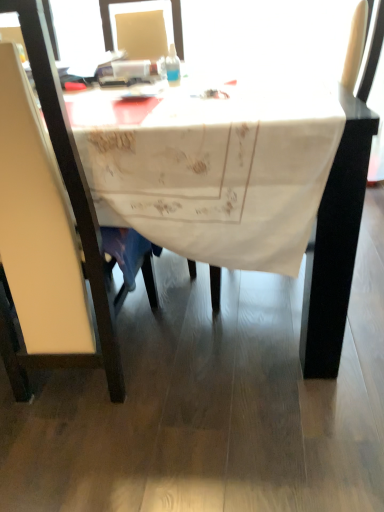
Question: Can you confirm if white leather chair at left is wider than white embroidered tablecloth at center?

Choices:
 (A) no
 (B) yes

Answer: (A)

Question: From the image's perspective, is white leather chair at left under white embroidered tablecloth at center?

Choices:
 (A) yes
 (B) no

Answer: (A)

Question: Is white leather chair at left not inside white embroidered tablecloth at center?

Choices:
 (A) yes
 (B) no

Answer: (B)

Question: Are white leather chair at left and white embroidered tablecloth at center beside each other?

Choices:
 (A) no
 (B) yes

Answer: (A)

Question: Is white leather chair at left at the right side of white embroidered tablecloth at center?

Choices:
 (A) yes
 (B) no

Answer: (B)

Question: Based on their positions, is white embroidered tablecloth at center located to the left or right of white leather chair at left?

Choices:
 (A) left
 (B) right

Answer: (B)

Question: From a real-world perspective, is white embroidered tablecloth at center positioned above or below white leather chair at left?

Choices:
 (A) above
 (B) below

Answer: (B)

Question: Looking at the image, does white embroidered tablecloth at center seem bigger or smaller compared to white leather chair at left?

Choices:
 (A) small
 (B) big

Answer: (B)

Question: From the image's perspective, is white embroidered tablecloth at center positioned above or below white leather chair at left?

Choices:
 (A) above
 (B) below

Answer: (A)

Question: Looking at their shapes, would you say white embroidered tablecloth at center is wider or thinner than transparent plastic bottle at center?

Choices:
 (A) thin
 (B) wide

Answer: (B)

Question: Is point click(105, 94) positioned closer to the camera than point click(173, 62)?

Choices:
 (A) closer
 (B) farther

Answer: (A)

Question: From a real-world perspective, relative to transparent plastic bottle at center, is white embroidered tablecloth at center vertically above or below?

Choices:
 (A) above
 (B) below

Answer: (B)

Question: From the image's perspective, relative to transparent plastic bottle at center, is white embroidered tablecloth at center above or below?

Choices:
 (A) below
 (B) above

Answer: (A)

Question: Is transparent plastic bottle at center wider or thinner than white leather chair at left?

Choices:
 (A) thin
 (B) wide

Answer: (A)

Question: From their relative heights in the image, would you say transparent plastic bottle at center is taller or shorter than white leather chair at left?

Choices:
 (A) short
 (B) tall

Answer: (A)